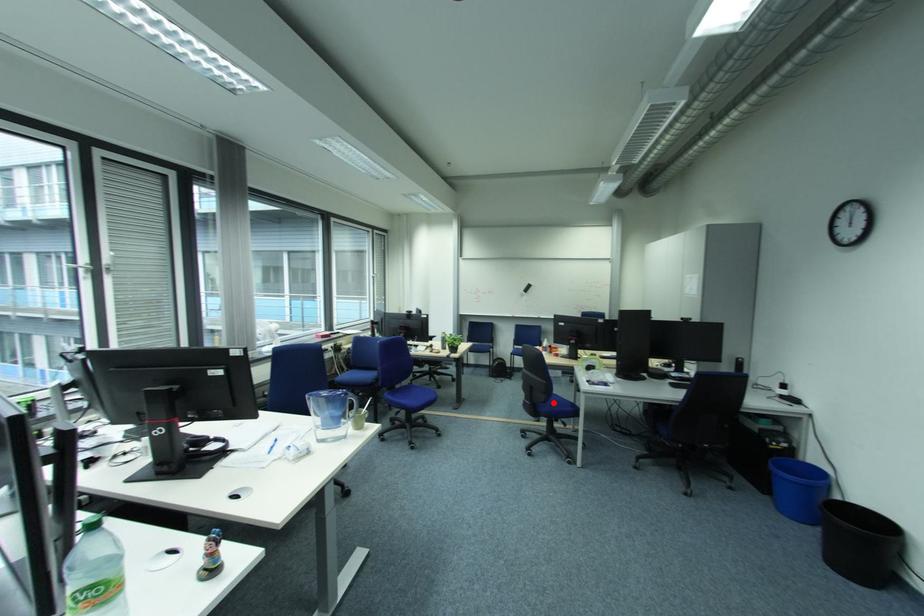
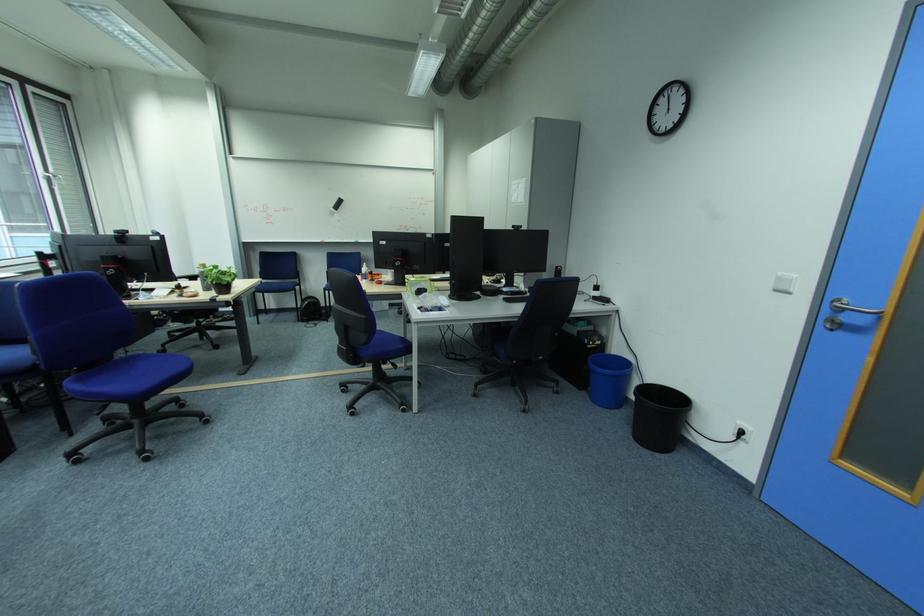
Question: I am providing you with two images of the same scene from different viewpoints. Given a red point in image1, look at the same physical point in image2. Is it:

Choices:
 (A) Closer to the viewpoint
 (B) Farther from the viewpoint

Answer: (A)